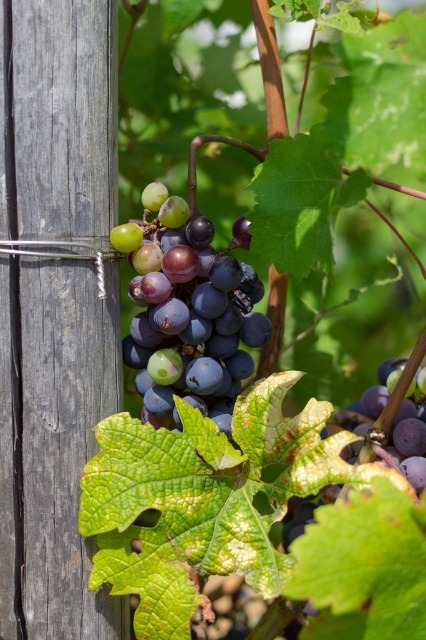
Question: Among these objects, which one is farthest from the camera?

Choices:
 (A) purple matte grape at lower right
 (B) shiny purple grapes at center

Answer: (B)

Question: Can you confirm if shiny purple grapes at center is positioned above purple matte grape at lower right?

Choices:
 (A) no
 (B) yes

Answer: (B)

Question: Which object appears farthest from the camera in this image?

Choices:
 (A) purple matte grape at lower right
 (B) shiny purple grapes at center

Answer: (B)

Question: In this image, where is shiny purple grapes at center located relative to purple matte grape at lower right?

Choices:
 (A) below
 (B) above

Answer: (B)

Question: Among these objects, which one is nearest to the camera?

Choices:
 (A) purple matte grape at lower right
 (B) shiny purple grapes at center

Answer: (A)

Question: Does shiny purple grapes at center lie in front of purple matte grape at lower right?

Choices:
 (A) no
 (B) yes

Answer: (A)